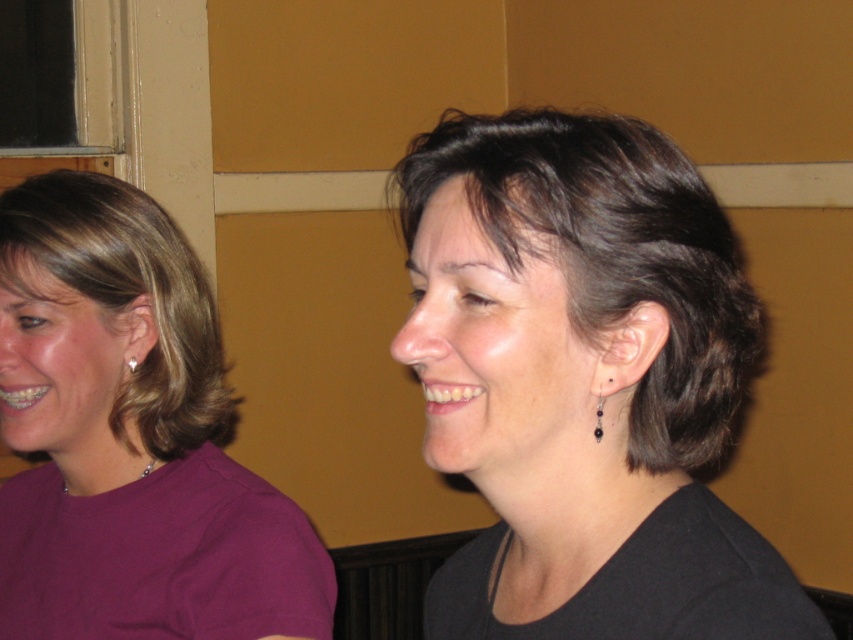
Question: Does blonde hair at left appear under silver/glass drop earrings at ear?

Choices:
 (A) yes
 (B) no

Answer: (B)

Question: Which point is closer to the camera?

Choices:
 (A) silver metallic earring at left
 (B) blonde hair at left
 (C) purple matte shirt at left
 (D) silver/glass drop earrings at ear

Answer: (D)

Question: Which point appears closest to the camera in this image?

Choices:
 (A) tap(329, 580)
 (B) tap(141, 228)
 (C) tap(511, 346)

Answer: (C)

Question: Based on their relative distances, which object is farther from the silver/glass drop earrings at ear?

Choices:
 (A) black matte hair at center
 (B) purple matte shirt at left
 (C) silver metallic earring at left
 (D) blonde hair at left

Answer: (D)

Question: Can you confirm if black matte hair at center is positioned below blonde hair at left?

Choices:
 (A) yes
 (B) no

Answer: (A)

Question: Does black matte hair at center have a lesser width compared to silver/glass drop earrings at ear?

Choices:
 (A) no
 (B) yes

Answer: (A)